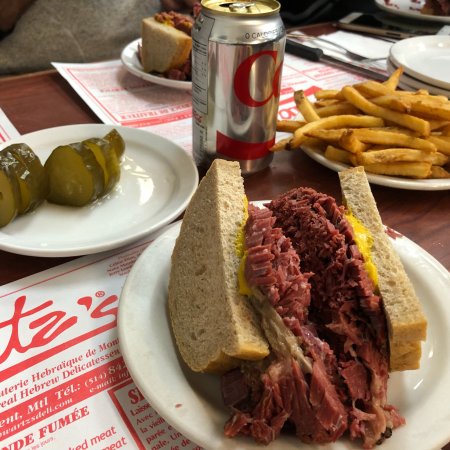
Locate an element on the screen. white plate is located at coordinates point(172,399).